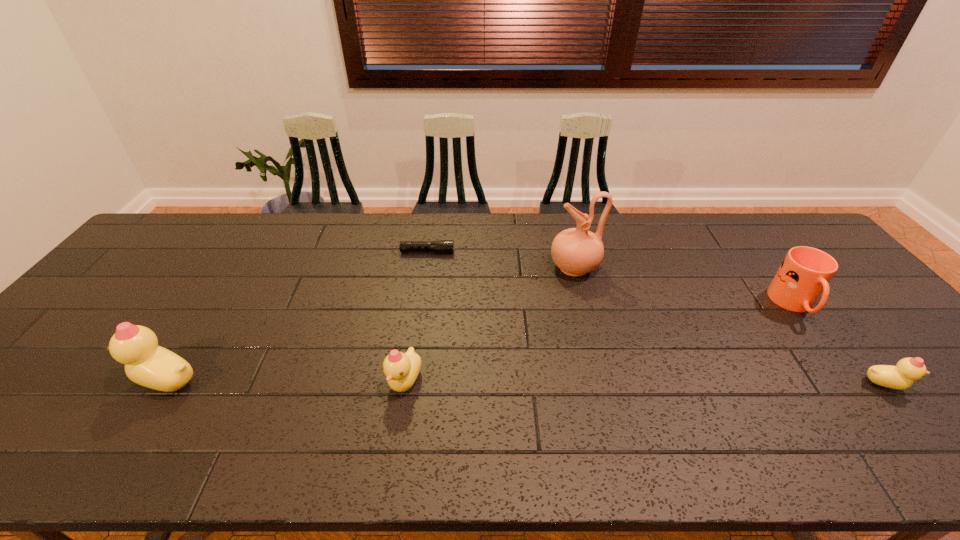
What are the coordinates of `duckling located in the right edge section of the desktop` in the screenshot? It's located at (902, 376).

Locate an element on the screen. The height and width of the screenshot is (540, 960). mug positioned at the right edge is located at coordinates (x=805, y=272).

Identify the location of object situated at the near right corner. (902, 376).

Where is `free space at the far edge of the desktop`? free space at the far edge of the desktop is located at coordinates (509, 242).

You are a GUI agent. You are given a task and a screenshot of the screen. Output one action in this format:
    pyautogui.click(x=<x>, y=<y>)
    Task: Click on the vacant space at the near edge of the desktop
    This screenshot has height=540, width=960.
    Given the screenshot: What is the action you would take?
    pyautogui.click(x=400, y=418)

In the image, there is a desktop. Where is `blank space at the left edge`? The width and height of the screenshot is (960, 540). blank space at the left edge is located at coordinates (93, 357).

Find the location of a particular element. Image resolution: width=960 pixels, height=540 pixels. vacant space at the right edge of the desktop is located at coordinates (867, 356).

Find the location of a particular element. The height and width of the screenshot is (540, 960). free space at the far right corner is located at coordinates (780, 224).

This screenshot has height=540, width=960. Identify the location of free space between the third object from right to left and the flashlight. (501, 260).

This screenshot has width=960, height=540. I want to click on vacant area that lies between the flashlight and the fifth tallest object, so click(x=657, y=318).